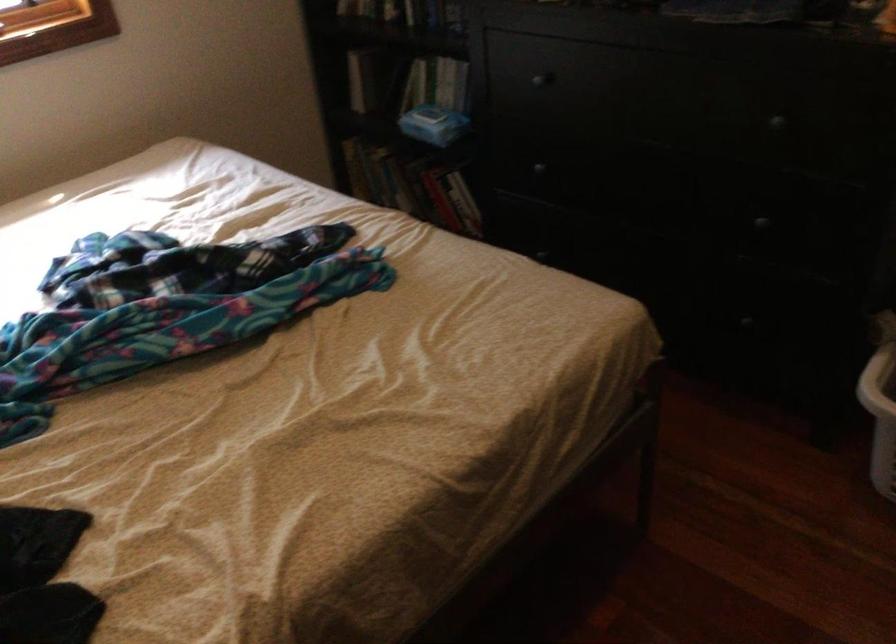
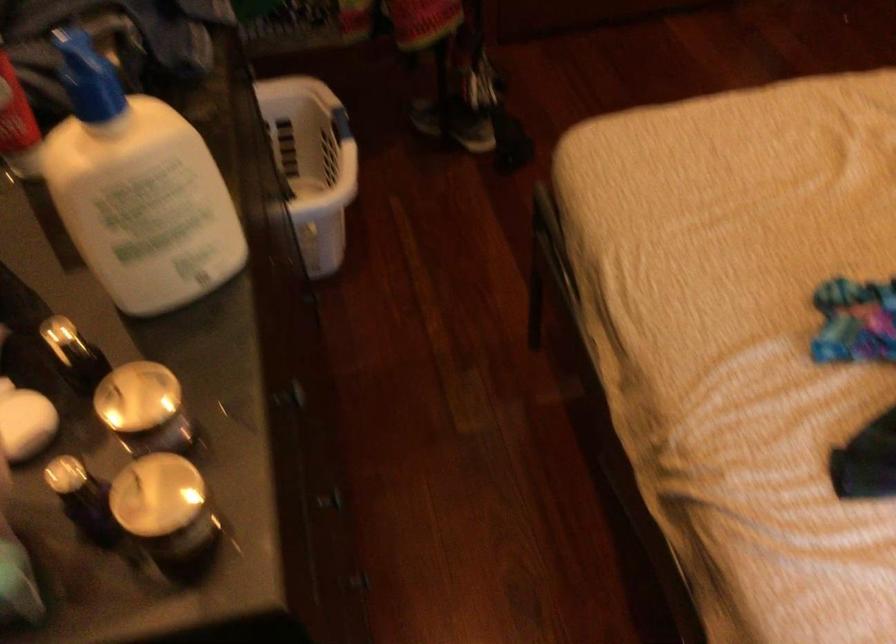
Find the pixel in the second image that matches the point at 548,75 in the first image.

(295, 393)